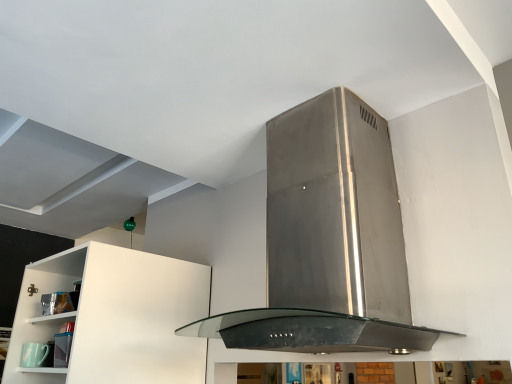
Question: Is stainless steel range hood at center far away from matte green cup at lower left?

Choices:
 (A) no
 (B) yes

Answer: (B)

Question: Is stainless steel range hood at center wider than matte green cup at lower left?

Choices:
 (A) yes
 (B) no

Answer: (A)

Question: Considering the relative sizes of stainless steel range hood at center and matte green cup at lower left in the image provided, is stainless steel range hood at center shorter than matte green cup at lower left?

Choices:
 (A) yes
 (B) no

Answer: (B)

Question: Is stainless steel range hood at center positioned with its back to matte green cup at lower left?

Choices:
 (A) yes
 (B) no

Answer: (B)

Question: Is stainless steel range hood at center next to matte green cup at lower left?

Choices:
 (A) yes
 (B) no

Answer: (B)

Question: Is the position of stainless steel range hood at center more distant than that of matte green cup at lower left?

Choices:
 (A) no
 (B) yes

Answer: (A)

Question: Could you tell me if matte green cup at lower left is turned towards stainless steel range hood at center?

Choices:
 (A) no
 (B) yes

Answer: (A)

Question: Considering the relative sizes of matte green cup at lower left and stainless steel range hood at center in the image provided, is matte green cup at lower left thinner than stainless steel range hood at center?

Choices:
 (A) no
 (B) yes

Answer: (B)

Question: Does matte green cup at lower left have a smaller size compared to stainless steel range hood at center?

Choices:
 (A) yes
 (B) no

Answer: (A)

Question: Is matte green cup at lower left positioned with its back to stainless steel range hood at center?

Choices:
 (A) no
 (B) yes

Answer: (A)

Question: Is there a large distance between matte green cup at lower left and stainless steel range hood at center?

Choices:
 (A) no
 (B) yes

Answer: (B)

Question: Is matte green cup at lower left at the right side of stainless steel range hood at center?

Choices:
 (A) no
 (B) yes

Answer: (A)

Question: From a real-world perspective, is matte green cup at lower left physically located above or below stainless steel range hood at center?

Choices:
 (A) above
 (B) below

Answer: (B)